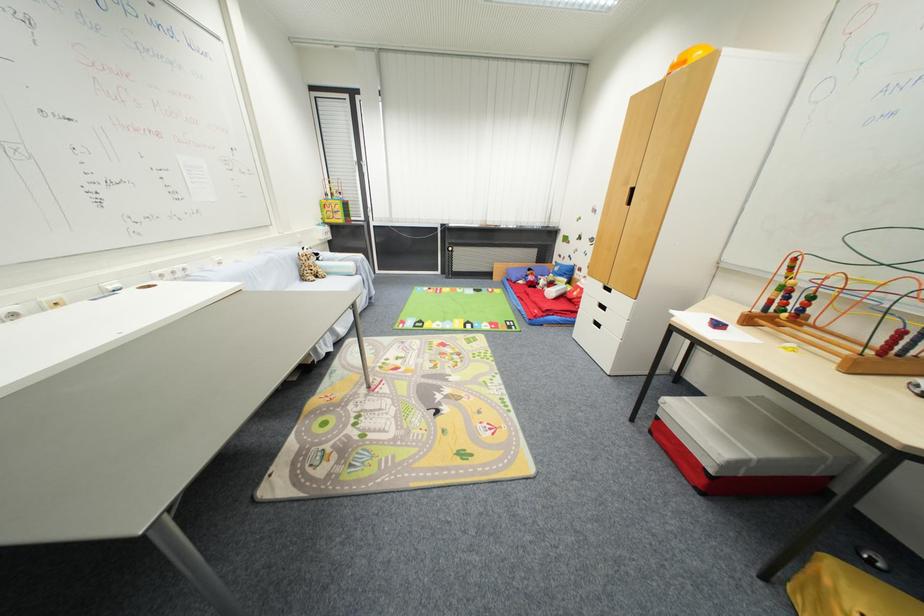
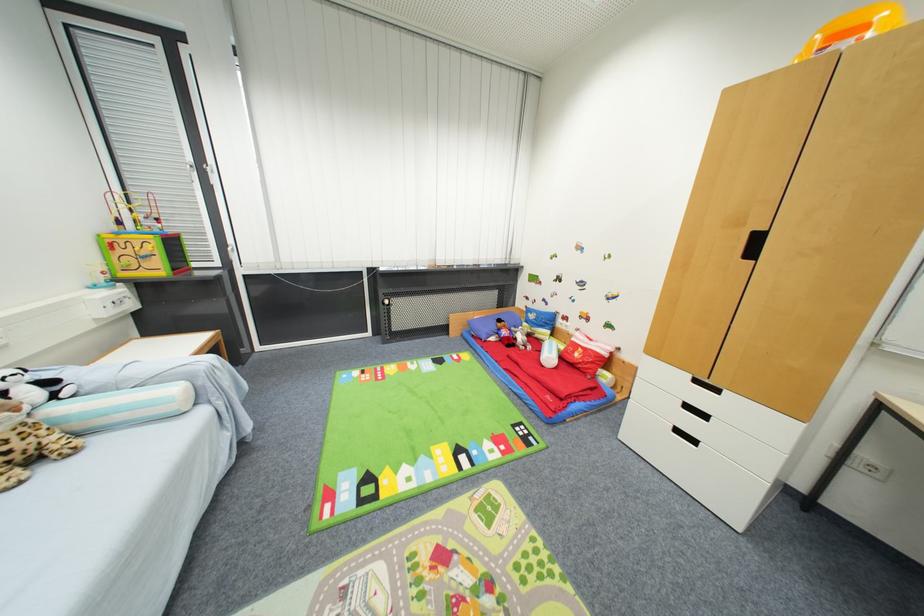
Locate, in the second image, the point that corresponds to pixel 535 272 in the first image.

(505, 323)